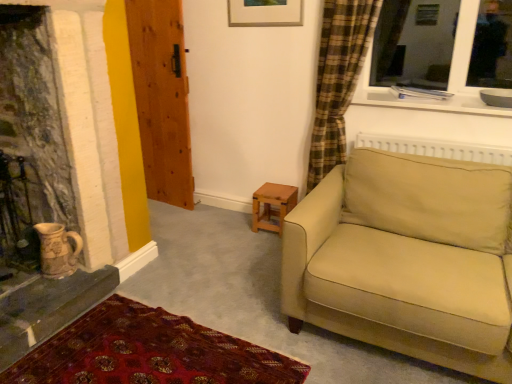
Question: From a real-world perspective, is earthenware jug at lower left physically located above or below beige fabric couch at right?

Choices:
 (A) below
 (B) above

Answer: (A)

Question: In terms of width, does earthenware jug at lower left look wider or thinner when compared to beige fabric couch at right?

Choices:
 (A) wide
 (B) thin

Answer: (B)

Question: Which of these objects is positioned farthest from the carpet with intricate patterns at lower left?

Choices:
 (A) wooden table at center
 (B) beige fabric couch at right
 (C) earthenware jug at lower left
 (D) wooden door at left

Answer: (D)

Question: Which is farther from the wooden table at center?

Choices:
 (A) beige fabric couch at right
 (B) wooden door at left
 (C) earthenware jug at lower left
 (D) carpet with intricate patterns at lower left

Answer: (C)